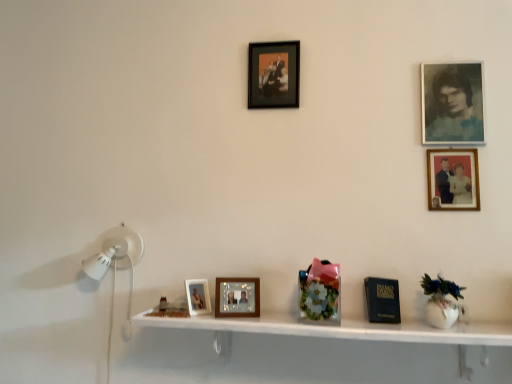
Question: Does wooden picture frame at upper right, which is the second picture frame from right to left, appear on the left side of blue-toned paper photo frame at upper right, the second picture frame in the top-to-bottom sequence?

Choices:
 (A) no
 (B) yes

Answer: (B)

Question: Considering the relative positions of wooden picture frame at upper right, which is the second picture frame from right to left, and blue-toned paper photo frame at upper right, the fourth picture frame in the bottom-to-top sequence, in the image provided, is wooden picture frame at upper right, which is the second picture frame from right to left, in front of blue-toned paper photo frame at upper right, the fourth picture frame in the bottom-to-top sequence,?

Choices:
 (A) yes
 (B) no

Answer: (A)

Question: Is wooden picture frame at upper right, which is the second picture frame from right to left, facing towards blue-toned paper photo frame at upper right, the second picture frame in the top-to-bottom sequence?

Choices:
 (A) yes
 (B) no

Answer: (B)

Question: From a real-world perspective, is wooden picture frame at upper right, the third picture frame from the top, physically above blue-toned paper photo frame at upper right, marked as the 1th picture frame in a right-to-left arrangement?

Choices:
 (A) yes
 (B) no

Answer: (B)

Question: Does wooden picture frame at upper right, which is the second picture frame from right to left, have a larger size compared to blue-toned paper photo frame at upper right, which ranks as the fifth picture frame in left-to-right order?

Choices:
 (A) yes
 (B) no

Answer: (B)

Question: Is wooden picture frame at upper right, which is the second picture frame from right to left, at the right side of blue-toned paper photo frame at upper right, which ranks as the fifth picture frame in left-to-right order?

Choices:
 (A) no
 (B) yes

Answer: (A)

Question: Is wooden photo frame at center, the 4th picture frame when ordered from right to left, closer to the viewer compared to matte wooden picture frame at center, placed as the first picture frame when sorted from left to right?

Choices:
 (A) no
 (B) yes

Answer: (B)

Question: Considering the relative sizes of wooden photo frame at center, the second picture frame in the left-to-right sequence, and matte wooden picture frame at center, placed as the first picture frame when sorted from left to right, in the image provided, is wooden photo frame at center, the second picture frame in the left-to-right sequence, wider than matte wooden picture frame at center, placed as the first picture frame when sorted from left to right,?

Choices:
 (A) yes
 (B) no

Answer: (B)

Question: Considering the relative sizes of wooden photo frame at center, which is counted as the 2th picture frame, starting from the bottom, and matte wooden picture frame at center, which is the 5th picture frame in right-to-left order, in the image provided, is wooden photo frame at center, which is counted as the 2th picture frame, starting from the bottom, bigger than matte wooden picture frame at center, which is the 5th picture frame in right-to-left order,?

Choices:
 (A) yes
 (B) no

Answer: (B)

Question: Does wooden photo frame at center, the second picture frame in the left-to-right sequence, have a lesser height compared to matte wooden picture frame at center, the 1th picture frame positioned from the bottom?

Choices:
 (A) yes
 (B) no

Answer: (B)

Question: From the image's perspective, would you say wooden photo frame at center, the second picture frame in the left-to-right sequence, is positioned over matte wooden picture frame at center, placed as the first picture frame when sorted from left to right?

Choices:
 (A) no
 (B) yes

Answer: (B)

Question: Is wooden photo frame at center, which is the 4th picture frame from top to bottom, at the right side of matte wooden picture frame at center, the 1th picture frame positioned from the bottom?

Choices:
 (A) yes
 (B) no

Answer: (A)

Question: Does matte wooden picture frame at center, which is the 5th picture frame in right-to-left order, appear on the left side of floral-patterned glass vase at center?

Choices:
 (A) yes
 (B) no

Answer: (A)